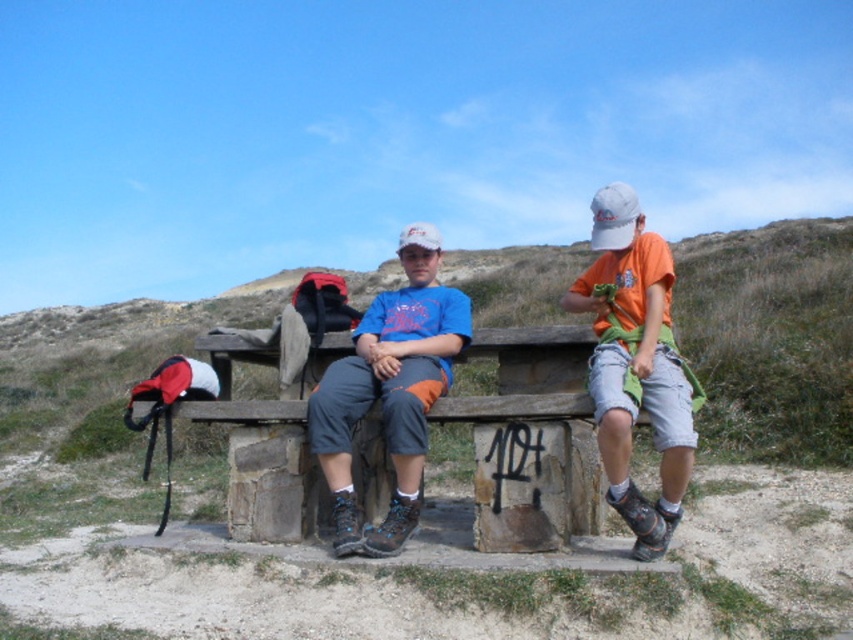
You are planning to set up a small table between the wooden bench at center and the orange cotton shirt at right. Considering their heights, which object should the table be placed closer to in order to ensure stability?

The wooden bench at center is not as tall as the orange cotton shirt at right, so the table should be placed closer to the wooden bench at center to ensure stability.